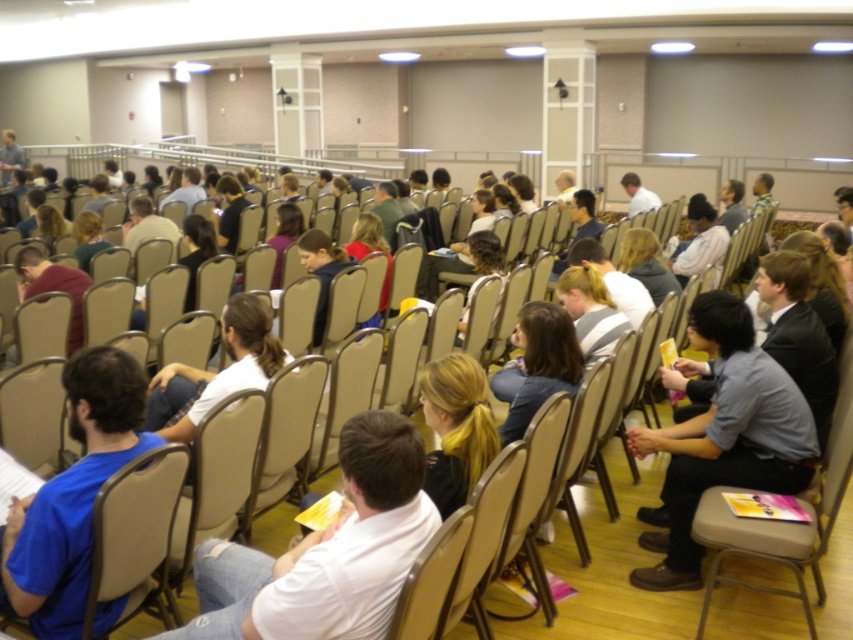
You are sitting in the front row of the assembly hall and notice two shirts at center. Which shirt is closer to you, the white cotton shirt at center or the dark blue shirt at center?

The white cotton shirt at center is closer to you because it is positioned under the dark blue shirt at center, indicating it is in front.

You are standing at the front of the assembly hall and notice a point marked at coordinates (326, 552) in the image. Based on the scene description, where is this point located?

The point at coordinates (326, 552) is located on the white matte shirt at center.

You are sitting in the beige plastic chair at lower left and want to look at the person wearing the dark blue shirt at center. Can you see their face without moving your head?

The beige plastic chair at lower left is below dark blue shirt at center, so yes, you can see the face of the person wearing the dark blue shirt at center without moving your head because the shirt is positioned above you.